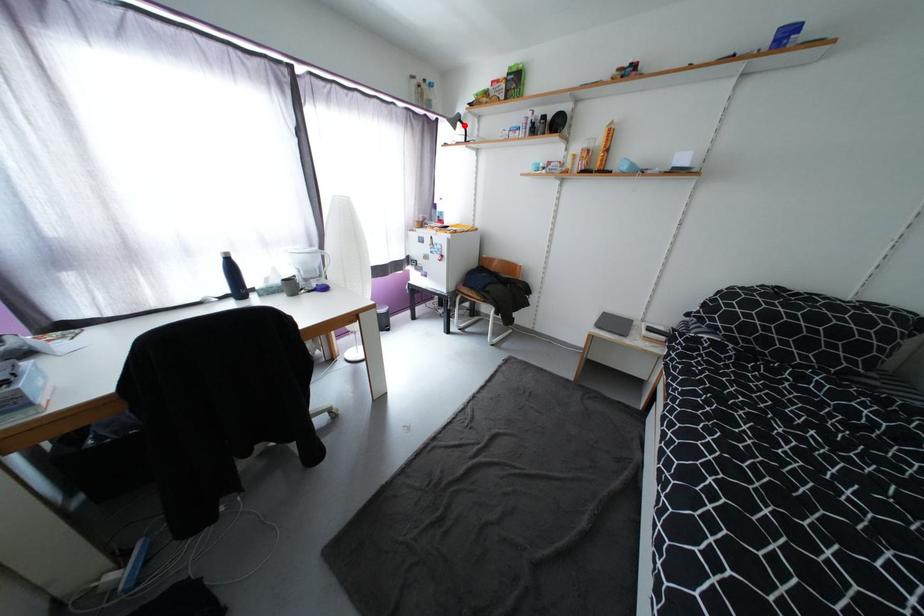
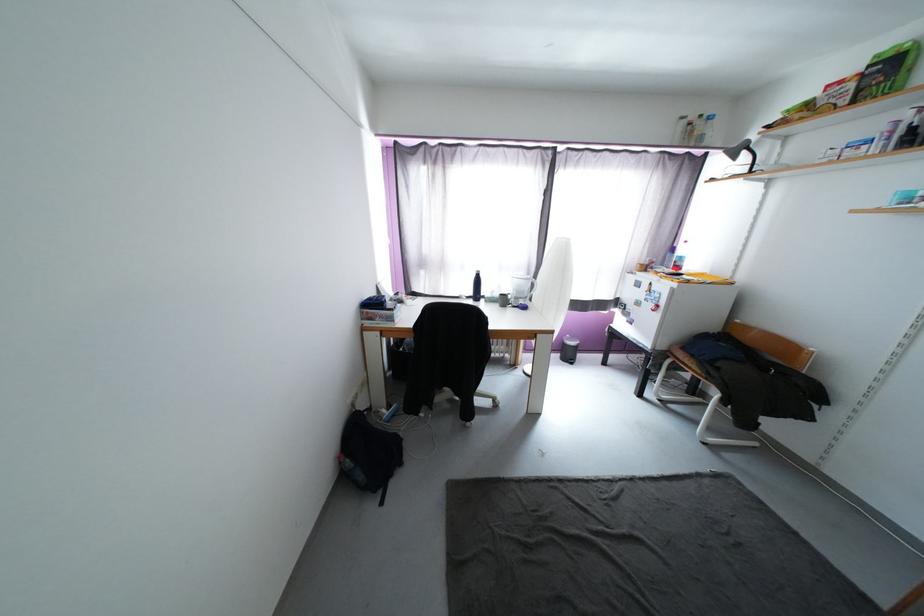
The point at the highlighted location is marked in the first image. Where is the corresponding point in the second image?

(749, 154)